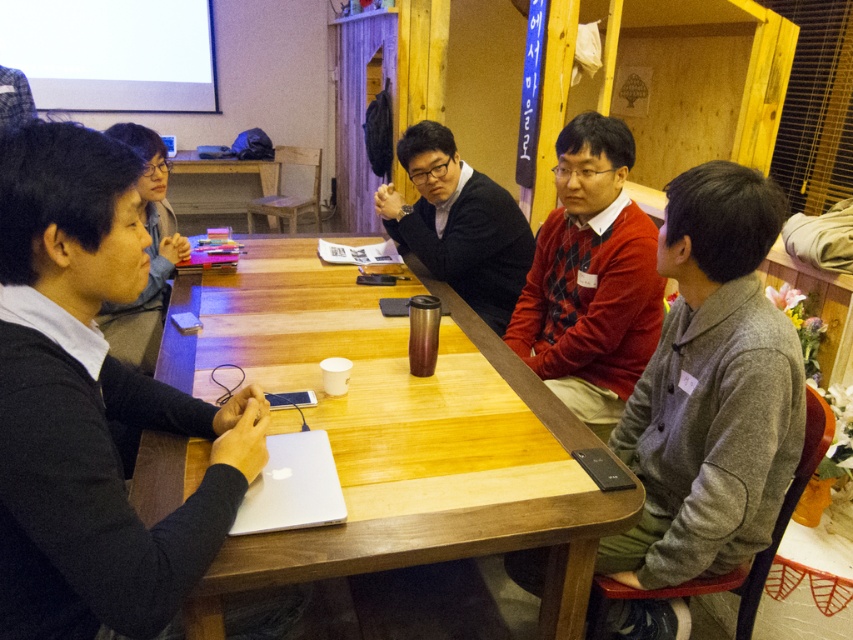
You are sitting at the table and want to hand a document to the person wearing the red sweater at center and the person wearing the matte black shirt at center. Which person is closer to you?

The red sweater at center is closer to you because it is in front of the matte black shirt at center.